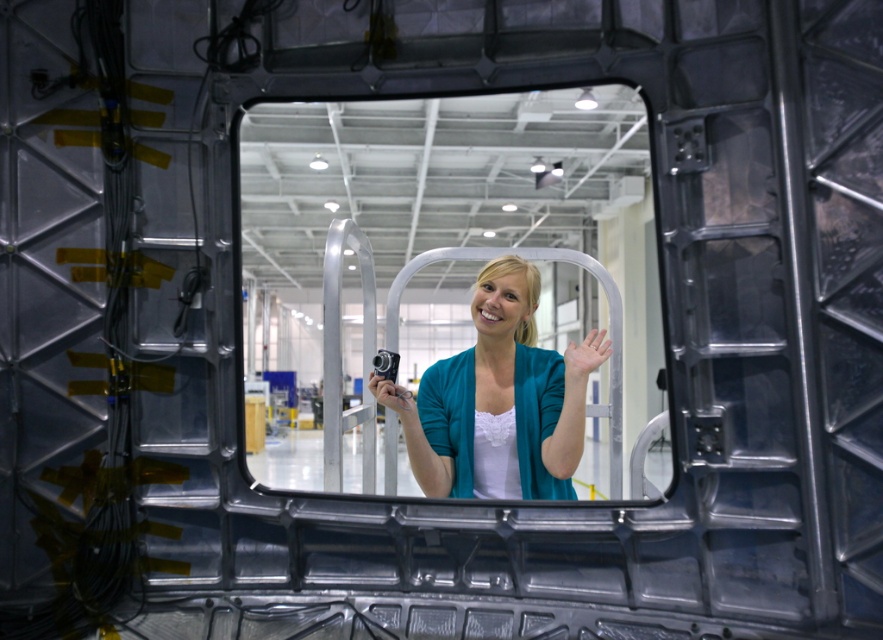
Question: Does matte skin hand at center come behind matte black camera at center?

Choices:
 (A) yes
 (B) no

Answer: (B)

Question: Does teal fabric jacket at center have a lesser width compared to matte skin hand at center?

Choices:
 (A) yes
 (B) no

Answer: (B)

Question: Which point is farther from the camera taking this photo?

Choices:
 (A) (389, 428)
 (B) (404, 396)
 (C) (527, 294)

Answer: (A)

Question: Does teal fabric jacket at center come behind matte black camera at center?

Choices:
 (A) yes
 (B) no

Answer: (A)

Question: Which point is farther to the camera?

Choices:
 (A) (495, 356)
 (B) (372, 372)
 (C) (521, 108)

Answer: (C)

Question: Which point is farther to the camera?

Choices:
 (A) matte black camera at center
 (B) clear glass mirror at center
 (C) matte skin hand at center
 (D) teal fabric jacket at center

Answer: (D)